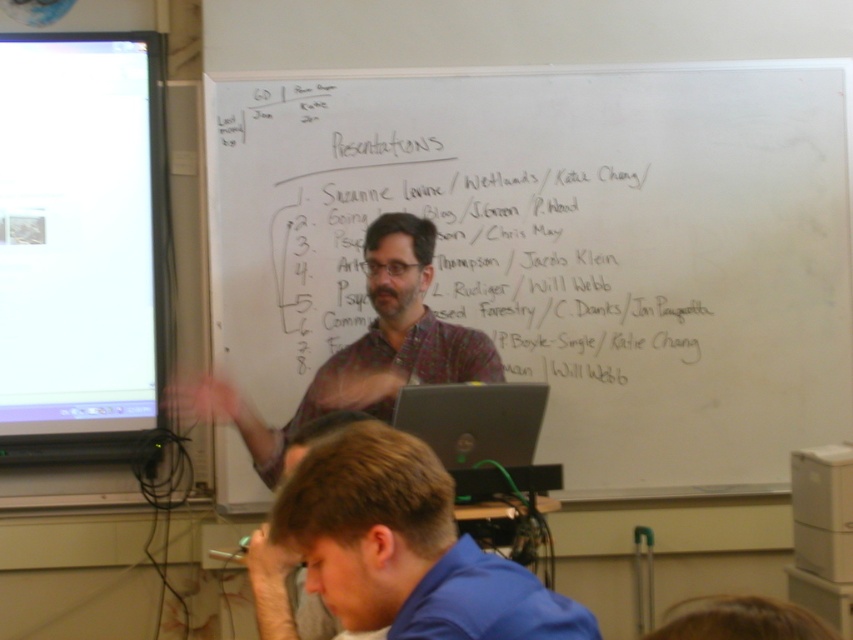
You are standing in the classroom and want to move to the point at coordinates (587, 202). The classroom has a 7.5 feet wide door on your left. Can you walk straight to the point without going through the door?

The point at coordinates (587, 202) is 10.33 feet away from you. Since the door is only 7.5 feet wide, you cannot walk straight to the point without passing through the door because the distance to the point exceeds the door width.